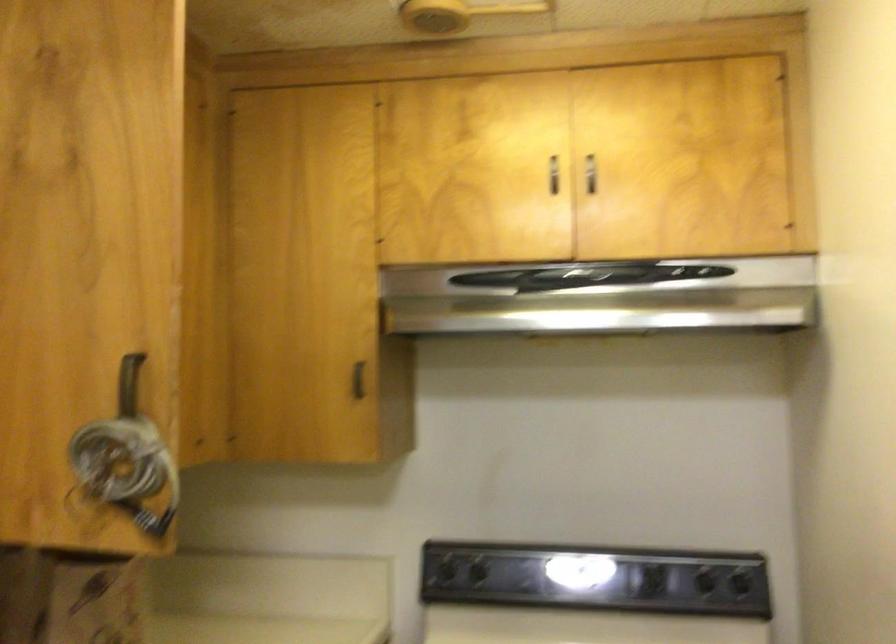
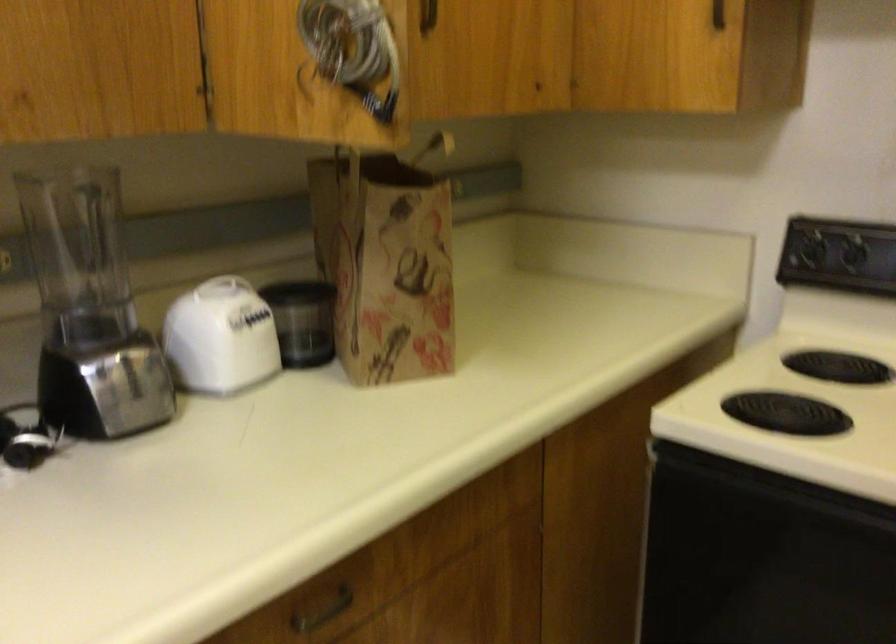
The images are taken continuously from a first-person perspective. In which direction is your viewpoint rotating?

The camera rotated toward left-down.